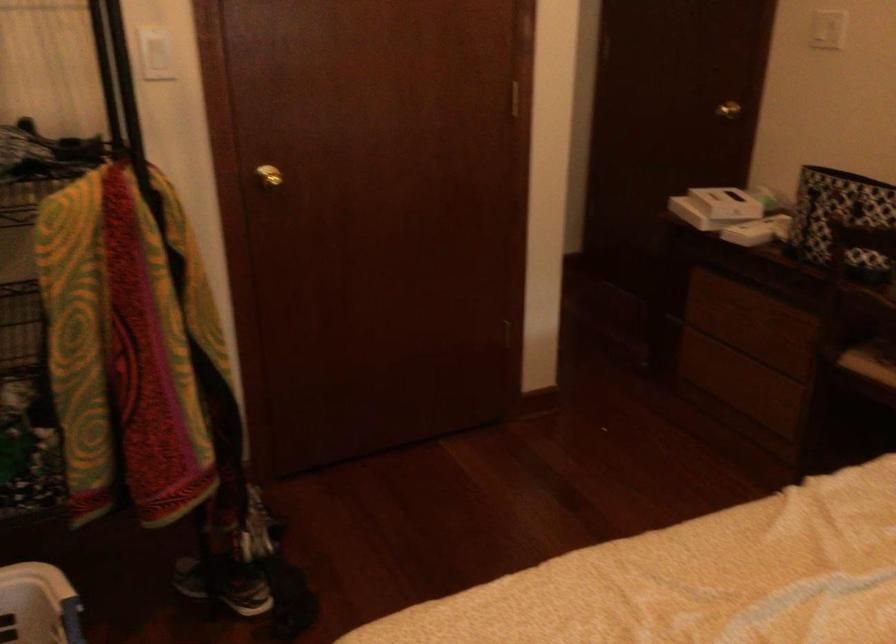
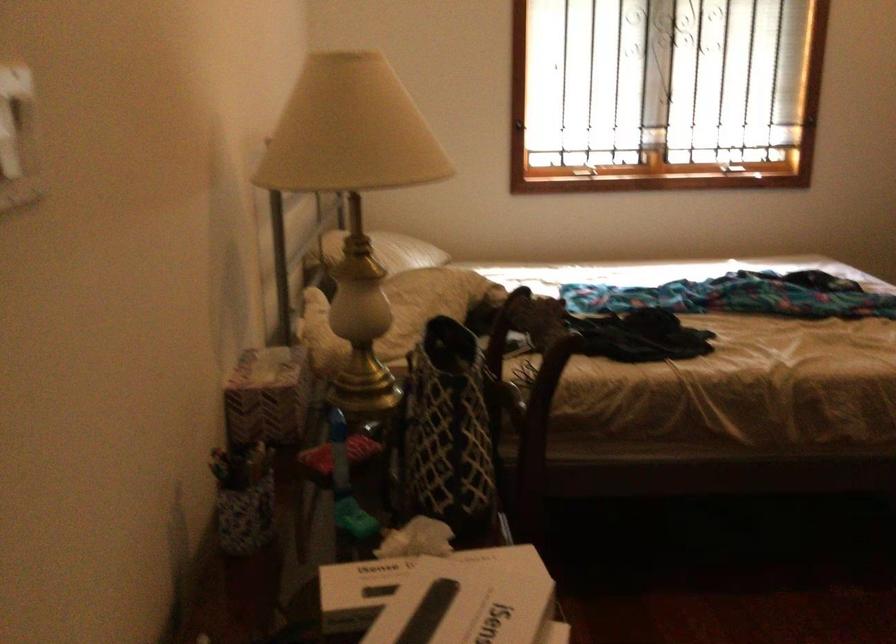
Locate, in the second image, the point that corresponds to (739,194) in the first image.

(407, 583)